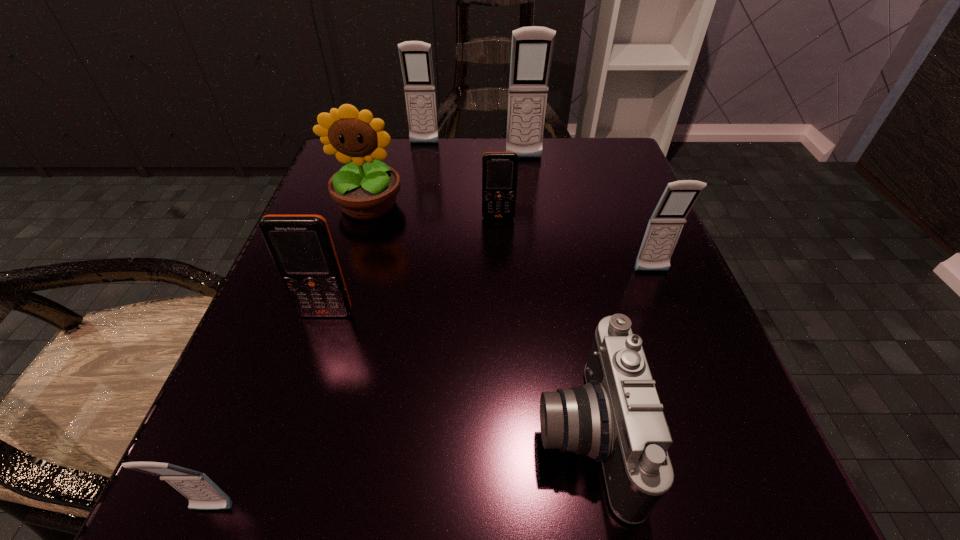
Find the location of a particular element. This screenshot has height=540, width=960. the right orange cellular telephone is located at coordinates (499, 169).

The height and width of the screenshot is (540, 960). In order to click on the leftmost gray cellular telephone in this screenshot , I will do `click(203, 494)`.

Find the location of a particular element. Image resolution: width=960 pixels, height=540 pixels. the nearest cellular telephone is located at coordinates (203, 494).

Locate an element on the screen. black camera is located at coordinates (616, 418).

Locate an element on the screen. This screenshot has width=960, height=540. vacant space located on the front-facing side of the third gray cellular telephone from left to right is located at coordinates (536, 244).

Where is `free space located 0.170m on the front-facing side of the farthest object`? This screenshot has height=540, width=960. free space located 0.170m on the front-facing side of the farthest object is located at coordinates (417, 189).

I want to click on vacant space located 0.390m on the face of the yellow sunflower, so click(300, 429).

Find the location of a particular element. The width and height of the screenshot is (960, 540). free spot located on the front-facing side of the third biggest gray cellular telephone is located at coordinates (686, 360).

Where is `free region located on the screen of the left orange cellular telephone`? free region located on the screen of the left orange cellular telephone is located at coordinates (299, 397).

What are the coordinates of `vacant region located on the screen of the farther orange cellular telephone` in the screenshot? It's located at (503, 316).